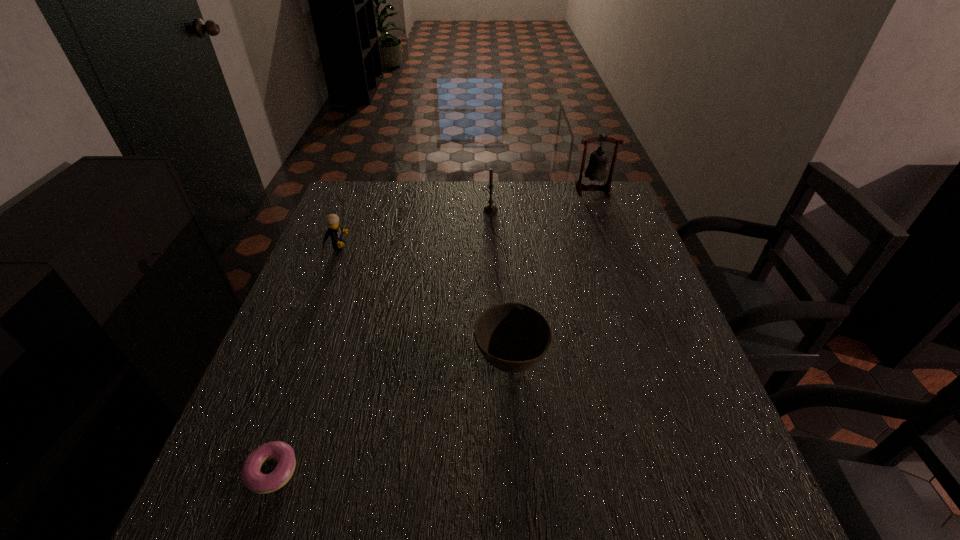
What are the coordinates of `object that is at the far right corner` in the screenshot? It's located at (596, 170).

Image resolution: width=960 pixels, height=540 pixels. Identify the location of free space at the far edge. (429, 189).

Where is `vacant space at the near edge`? vacant space at the near edge is located at coordinates (586, 516).

Locate an element on the screen. The height and width of the screenshot is (540, 960). vacant space at the left edge of the desktop is located at coordinates (267, 442).

The image size is (960, 540). What are the coordinates of `free space at the right edge of the desktop` in the screenshot? It's located at [633, 236].

In the image, there is a desktop. Find the location of `blank space at the far left corner`. blank space at the far left corner is located at coordinates (378, 207).

What are the coordinates of `vacant area at the near left corner of the desktop` in the screenshot? It's located at (281, 511).

You are a GUI agent. You are given a task and a screenshot of the screen. Output one action in this format:
    pyautogui.click(x=<x>, y=<y>)
    Task: Click on the free space at the far right corner
    The image size is (960, 540).
    Given the screenshot: What is the action you would take?
    pyautogui.click(x=580, y=210)

You are a GUI agent. You are given a task and a screenshot of the screen. Output one action in this format:
    pyautogui.click(x=<x>, y=<y>)
    Task: Click on the vacant area that lies between the second nearest object and the Lego
    This screenshot has height=540, width=960.
    Given the screenshot: What is the action you would take?
    pyautogui.click(x=424, y=304)

This screenshot has height=540, width=960. I want to click on vacant space that is in between the shortest object and the third nearest object, so click(305, 359).